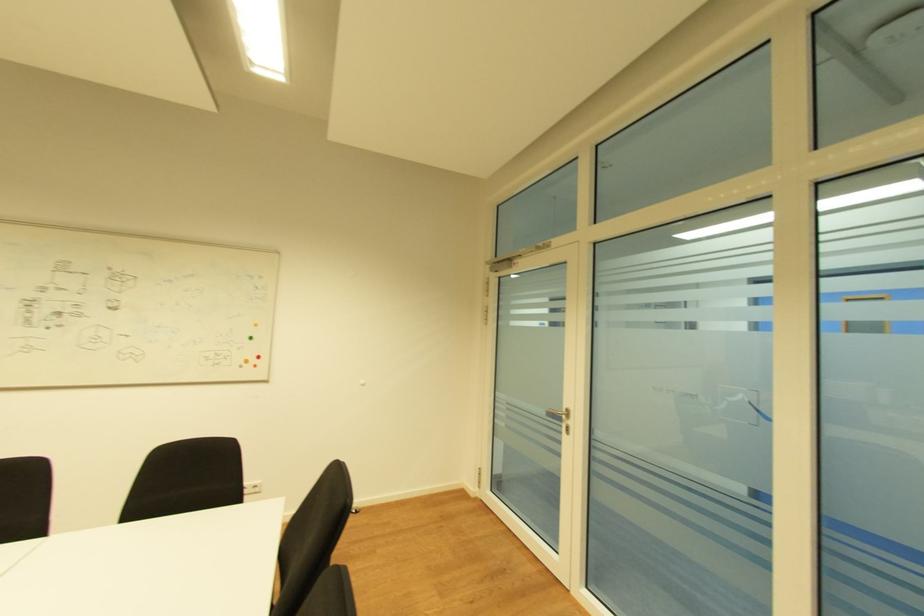
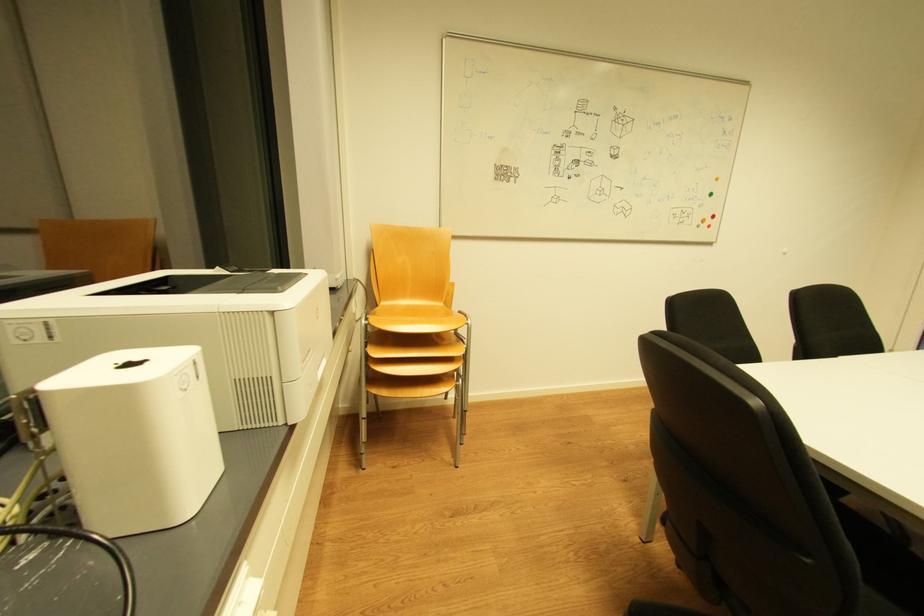
Question: What movement of the cameraman would produce the second image?

Choices:
 (A) Left
 (B) Right
 (C) Forward
 (D) Backward

Answer: (A)